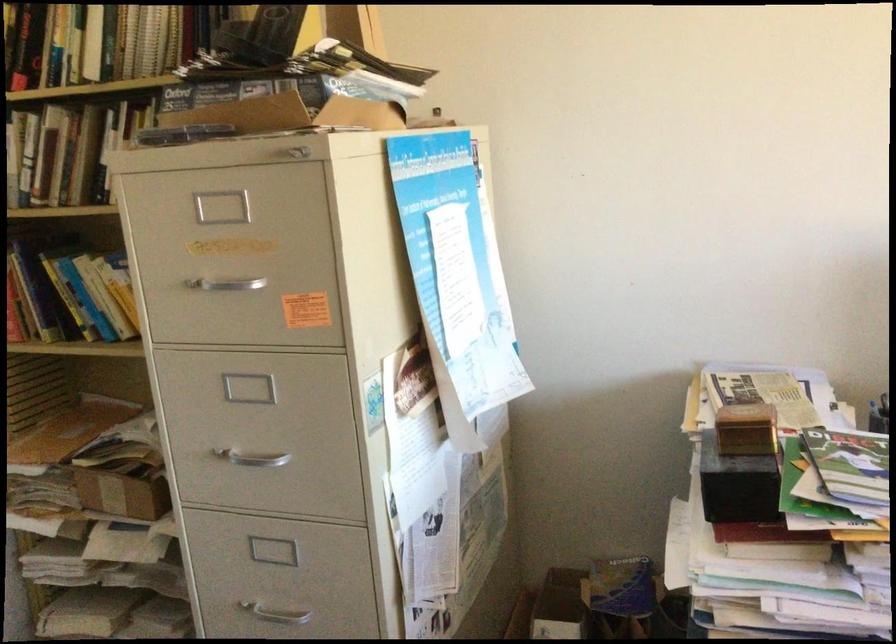
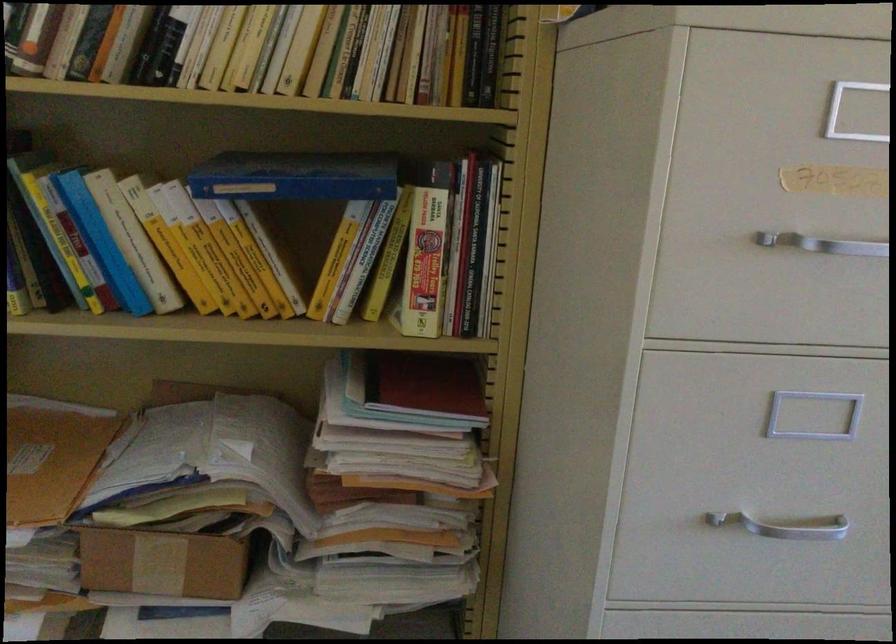
Where in the second image is the point corresponding to point 104,494 from the first image?

(161, 564)